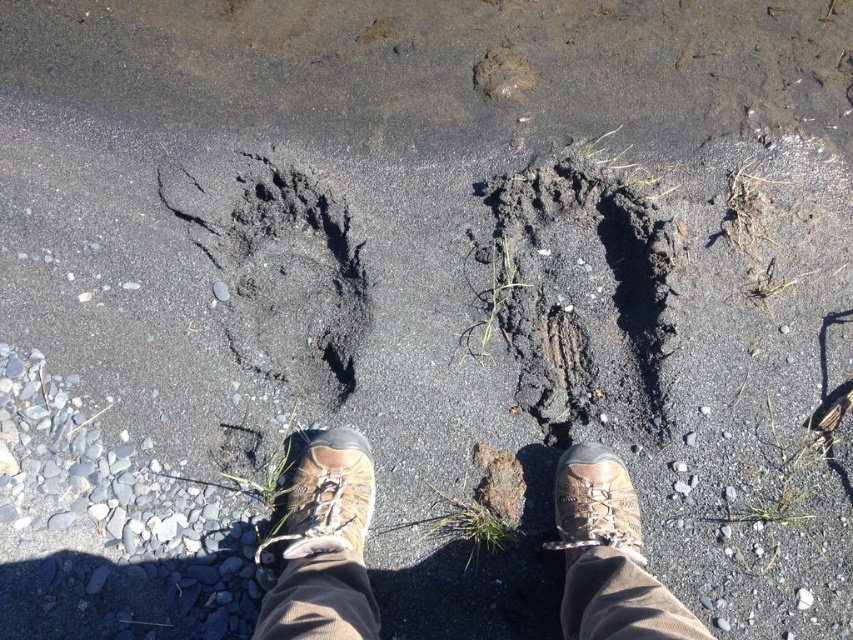
Which is more to the left, dark mud footprint at center or brown leather shoe at lower center?

Positioned to the left is brown leather shoe at lower center.

Which of these two, dark mud footprint at center or brown leather shoe at lower center, stands shorter?

brown leather shoe at lower center is shorter.

Is point (518, 273) closer to viewer compared to point (610, 528)?

No, it is not.

Find the location of a particular element. The height and width of the screenshot is (640, 853). dark mud footprint at center is located at coordinates (582, 296).

Which is more to the right, dark gray mud footprint at center or brown leather shoe at center?

Positioned to the right is brown leather shoe at center.

Is dark gray mud footprint at center to the left of brown leather shoe at center from the viewer's perspective?

Correct, you'll find dark gray mud footprint at center to the left of brown leather shoe at center.

Between point (245, 339) and point (361, 550), which one is positioned in front?

Point (361, 550) is in front.

At what (x,y) coordinates should I click in order to perform the action: click on dark gray mud footprint at center. Please return your answer as a coordinate pair (x, y). The height and width of the screenshot is (640, 853). Looking at the image, I should click on (279, 269).

Does dark mud footprint at center have a greater width compared to dark gray mud footprint at center?

No, dark mud footprint at center is not wider than dark gray mud footprint at center.

Is point (602, 314) farther from camera compared to point (308, 262)?

No, (602, 314) is in front of (308, 262).

You are a GUI agent. You are given a task and a screenshot of the screen. Output one action in this format:
    pyautogui.click(x=<x>, y=<y>)
    Task: Click on the dark mud footprint at center
    
    Given the screenshot: What is the action you would take?
    pyautogui.click(x=582, y=296)